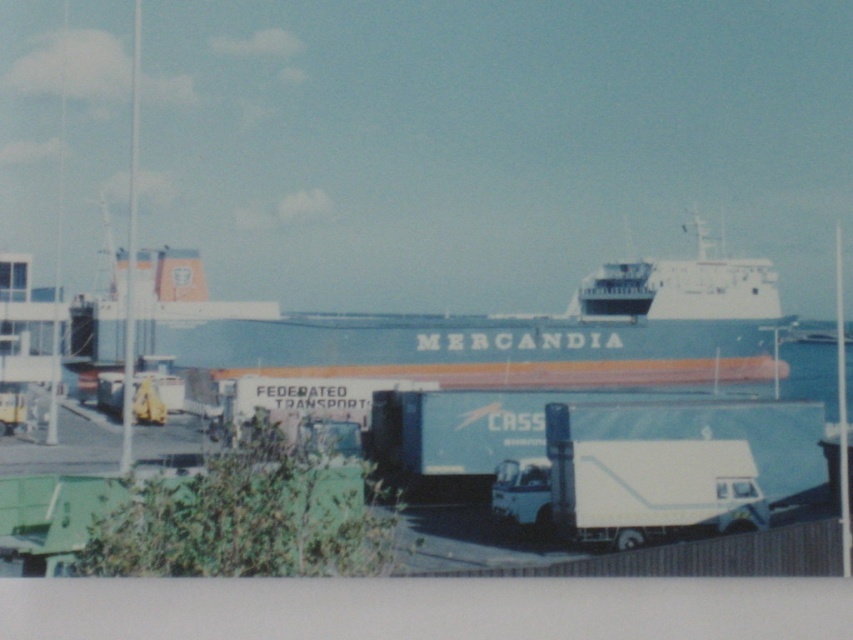
Measure the distance from white matte ship at center to white matte trailer truck at center.

white matte ship at center is 78.88 meters from white matte trailer truck at center.

Does white matte ship at center appear under white matte trailer truck at center?

No, white matte ship at center is not below white matte trailer truck at center.

Who is more distant from viewer, [225,360] or [715,509]?

The point [225,360] is more distant.

This screenshot has height=640, width=853. I want to click on white matte ship at center, so click(x=521, y=333).